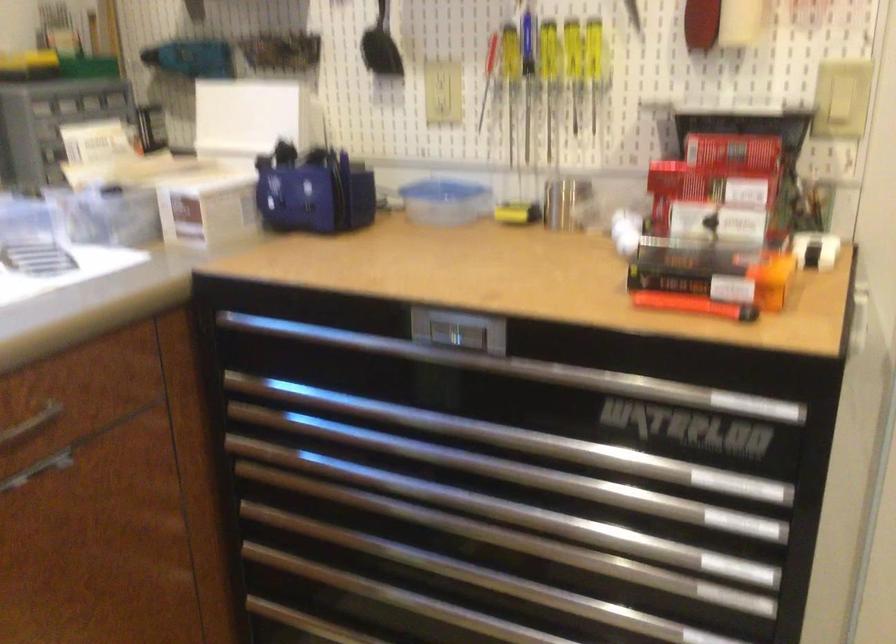
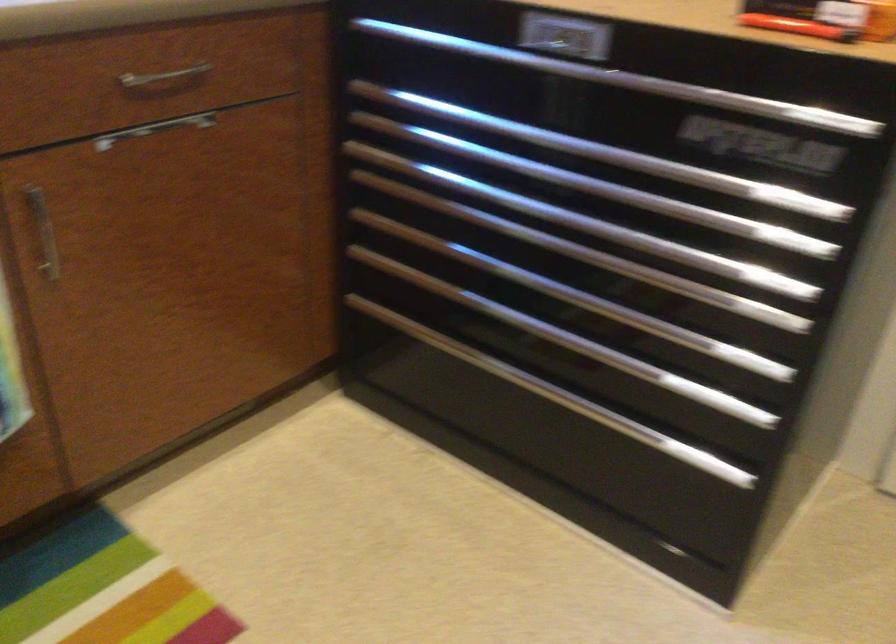
In the second image, find the point that corresponds to point (495, 430) in the first image.

(580, 144)